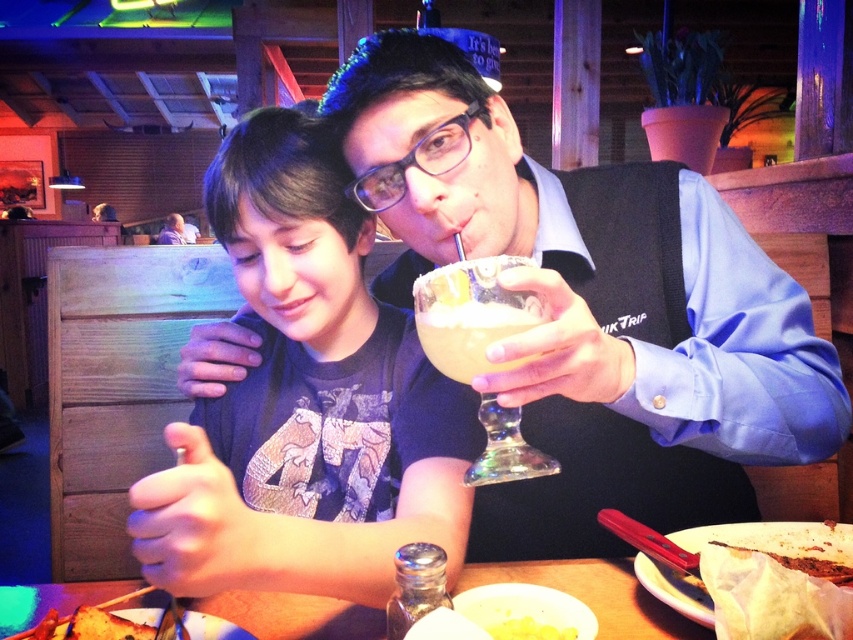
Does matte black shirt at center appear over yellow creamy sauce at lower center?

Correct, matte black shirt at center is located above yellow creamy sauce at lower center.

Is point (404, 440) in front of point (517, 636)?

No, (404, 440) is behind (517, 636).

Where is `matte black shirt at center`? This screenshot has width=853, height=640. matte black shirt at center is located at coordinates (306, 401).

Consider the image. Which is more to the right, wooden table at center or white creamy bread at lower right?

Positioned to the right is white creamy bread at lower right.

Can you confirm if wooden table at center is thinner than white creamy bread at lower right?

Incorrect, wooden table at center's width is not less than white creamy bread at lower right's.

You are a GUI agent. You are given a task and a screenshot of the screen. Output one action in this format:
    pyautogui.click(x=<x>, y=<y>)
    Task: Click on the wooden table at center
    
    Given the screenshot: What is the action you would take?
    click(596, 595)

Between point (283, 156) and point (440, 358), which one is positioned in front?

Point (440, 358)

Describe the element at coordinates (306, 401) in the screenshot. This screenshot has height=640, width=853. I see `matte black shirt at center` at that location.

Find the location of `matte black shirt at center`. matte black shirt at center is located at coordinates (306, 401).